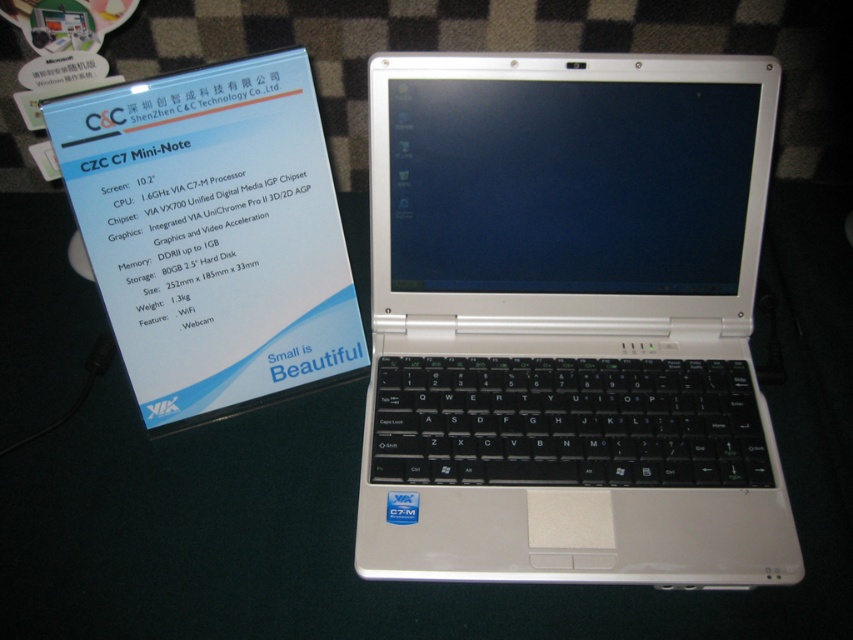
Does white plastic laptop at center have a larger size compared to green matte table at center?

Incorrect, white plastic laptop at center is not larger than green matte table at center.

Is point (376, 308) in front of point (35, 314)?

Yes, point (376, 308) is in front of point (35, 314).

Where is `white plastic laptop at center`? white plastic laptop at center is located at coordinates (567, 321).

How far apart are green matte table at center and white paper at upper left?

green matte table at center and white paper at upper left are 8.20 inches apart.

Based on the photo, does green matte table at center appear over white paper at upper left?

Incorrect, green matte table at center is not positioned above white paper at upper left.

Is point (361, 378) less distant than point (283, 156)?

No, (361, 378) is further to viewer.

The image size is (853, 640). I want to click on green matte table at center, so click(357, 504).

Does point (583, 132) lie in front of point (294, 253)?

Yes, it is.

In order to click on white plastic laptop at center in this screenshot , I will do `click(567, 321)`.

Who is more forward, (524, 509) or (196, 352)?

Positioned in front is point (524, 509).

Find the location of `white plastic laptop at center`. white plastic laptop at center is located at coordinates (567, 321).